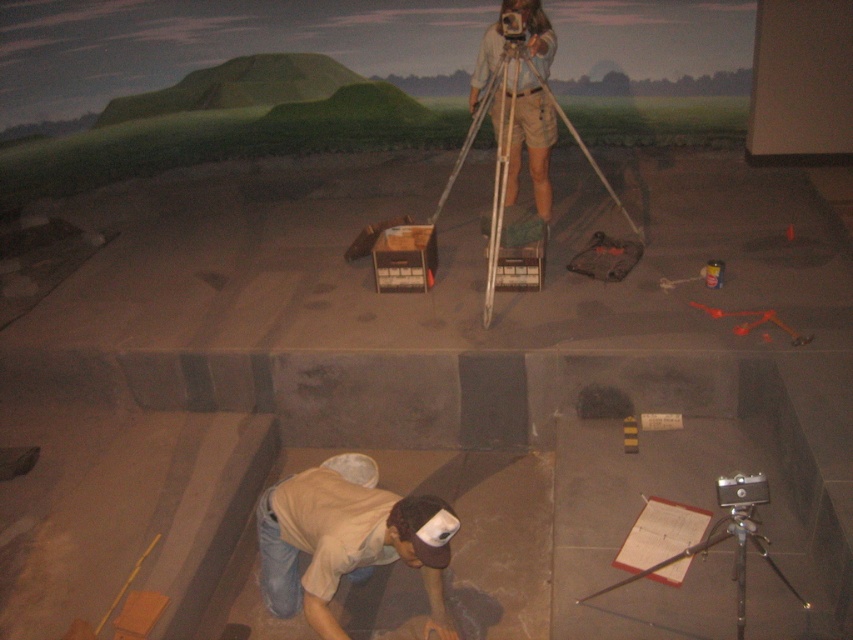
You are a photographer at the archaeological dig site. You need to set up your equipment so that the camera is positioned higher than the tripod to capture a better angle. Is the silver metallic camera at lower right taller than the silver metallic tripod at upper center?

The silver metallic camera at lower right is not as tall as the silver metallic tripod at upper center, so it cannot be positioned higher than the tripod to capture a better angle.

You are a visitor at the archaeological dig site. You notice the matte khaki shorts at center and the silver metallic tripod at upper center. Which object is closer to the ground?

The matte khaki shorts at center is positioned under the silver metallic tripod at upper center, so it is closer to the ground.